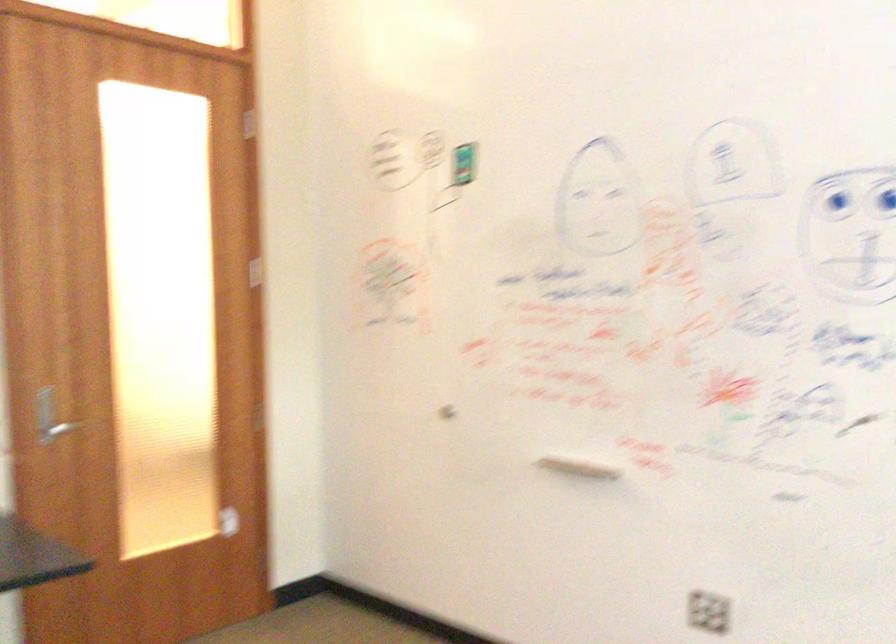
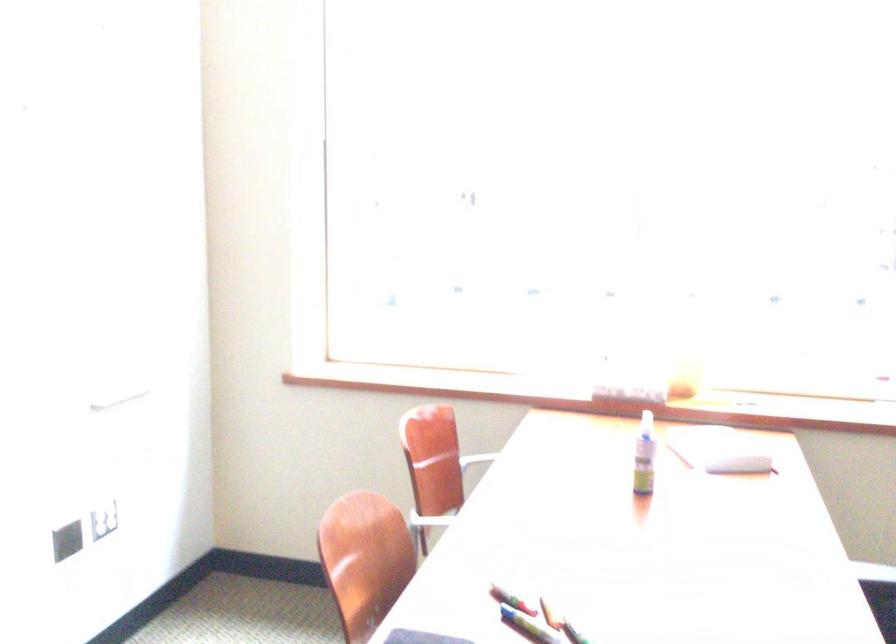
Question: The camera is either moving clockwise (left) or counter-clockwise (right) around the object. The first image is from the beginning of the video and the second image is from the end. Is the camera moving left or right when shooting the video?

Choices:
 (A) Left
 (B) Right

Answer: (A)